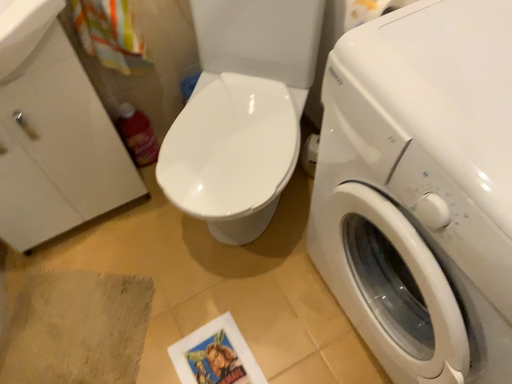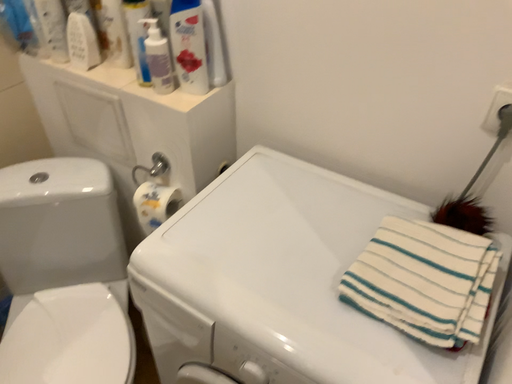
Question: Which way did the camera rotate in the video?

Choices:
 (A) rotated left
 (B) rotated right

Answer: (B)